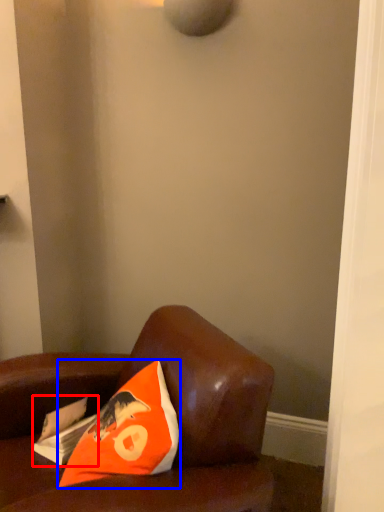
Question: Among these objects, which one is farthest to the camera, magazine (highlighted by a red box) or pillow (highlighted by a blue box)?

Choices:
 (A) magazine
 (B) pillow

Answer: (A)